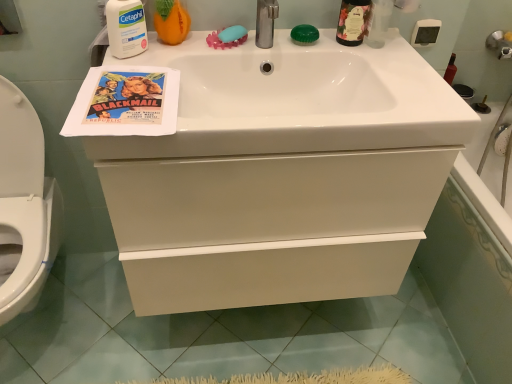
Question: Is white matte cetaphil at upper left, the first cleaning product positioned from the left, wider or thinner than white glossy bathtub at right?

Choices:
 (A) wide
 (B) thin

Answer: (B)

Question: Relative to white glossy bathtub at right, is white matte cetaphil at upper left, which appears as the second cleaning product when viewed from the right, in front or behind?

Choices:
 (A) front
 (B) behind

Answer: (A)

Question: Estimate the real-world distances between objects in this image. Which object is closer to the white glossy bathtub at right?

Choices:
 (A) blue rubber soap at upper center, which is the 2th soap from right to left
 (B) white glossy cabinet at center
 (C) white matte cetaphil at upper left, the first cleaning product positioned from the left
 (D) matte paper poster at upper left
 (E) white glossy toilet at lower left

Answer: (B)

Question: Which object is positioned farthest from the white matte cetaphil at upper left, which appears as the second cleaning product when viewed from the right?

Choices:
 (A) green glass bottle at upper right
 (B) matte paper poster at upper left
 (C) white glossy sink at upper center
 (D) blue rubber soap at upper center, the 1th soap viewed from the left
 (E) white glossy cabinet at center

Answer: (A)